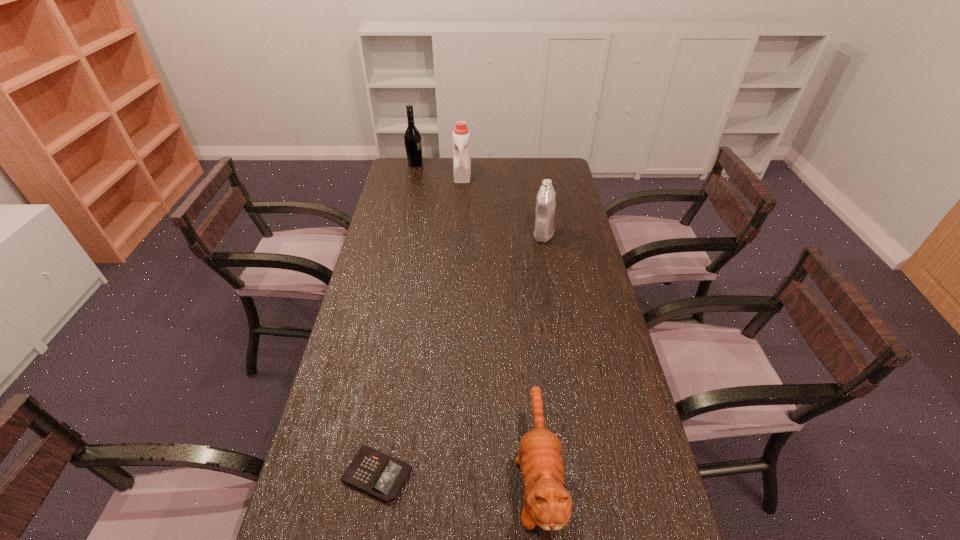
The height and width of the screenshot is (540, 960). Find the location of `wine bottle`. wine bottle is located at coordinates (412, 138).

Where is `the farther detergent`? The height and width of the screenshot is (540, 960). the farther detergent is located at coordinates (461, 135).

Find the location of a particular element. This screenshot has width=960, height=540. the left detergent is located at coordinates (461, 135).

Locate an element on the screen. the right detergent is located at coordinates (545, 207).

You are a GUI agent. You are given a task and a screenshot of the screen. Output one action in this format:
    pyautogui.click(x=<x>, y=<y>)
    Task: Click on the third farthest object
    This screenshot has height=540, width=960.
    Given the screenshot: What is the action you would take?
    pyautogui.click(x=545, y=207)

Locate an element on the screen. calculator is located at coordinates (378, 474).

Locate an element on the screen. The width and height of the screenshot is (960, 540). free space located on the label of the wine bottle is located at coordinates (444, 164).

The image size is (960, 540). In order to click on vacant space situated on the handle side of the left detergent in this screenshot , I will do `click(460, 226)`.

The image size is (960, 540). I want to click on free space located 0.180m on the back of the nearer detergent, so click(538, 201).

Locate an element on the screen. This screenshot has height=540, width=960. free region located on the back of the calculator is located at coordinates [x=395, y=370].